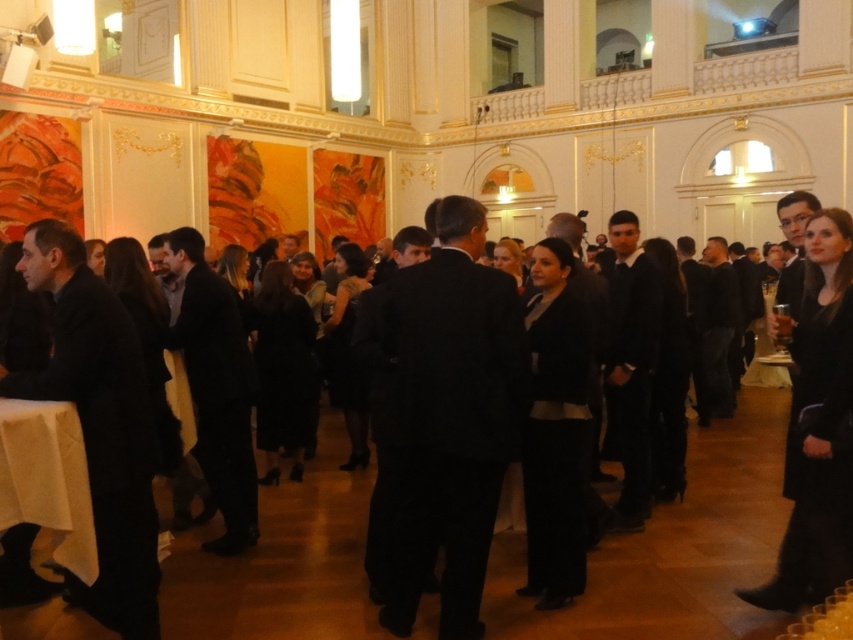
Is black wool coat at right behind white cloth at lower left?

Yes, it is behind white cloth at lower left.

Can you confirm if black wool coat at right is thinner than white cloth at lower left?

No, black wool coat at right is not thinner than white cloth at lower left.

The width and height of the screenshot is (853, 640). In order to click on black wool coat at right in this screenshot , I will do [x=816, y=424].

At what (x,y) coordinates should I click in order to perform the action: click on black wool coat at right. Please return your answer as a coordinate pair (x, y). This screenshot has height=640, width=853. Looking at the image, I should click on (816, 424).